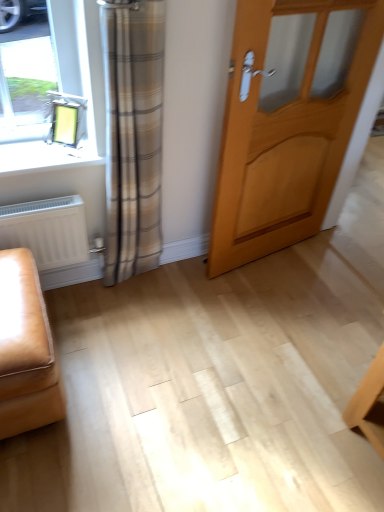
Find the location of a particular element. The height and width of the screenshot is (512, 384). free point to the right of light wood door at center is located at coordinates (326, 270).